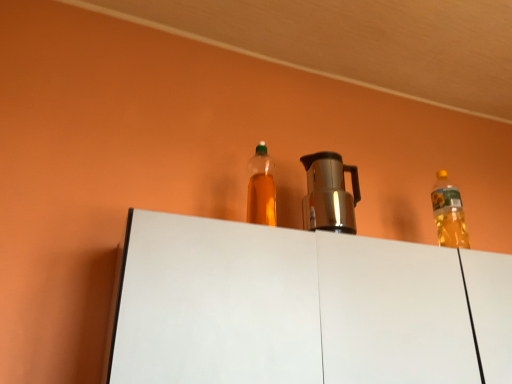
Question: Is satin silver coffee pot at center in front of or behind white matte cabinet at center in the image?

Choices:
 (A) behind
 (B) front

Answer: (A)

Question: In the image, is satin silver coffee pot at center on the left side or the right side of white matte cabinet at center?

Choices:
 (A) right
 (B) left

Answer: (B)

Question: Which of these objects is positioned farthest from the satin silver coffee pot at center?

Choices:
 (A) translucent plastic bottle at center
 (B) white matte cabinet at center

Answer: (B)

Question: Which object is positioned farthest from the translucent plastic bottle at center?

Choices:
 (A) satin silver coffee pot at center
 (B) white matte cabinet at center

Answer: (A)